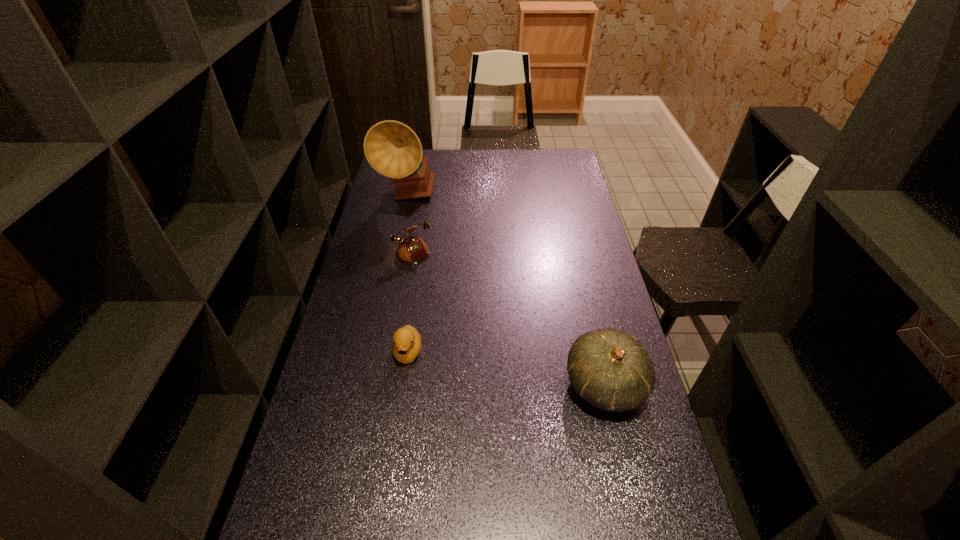
Image resolution: width=960 pixels, height=540 pixels. In order to click on free space at the right edge of the desktop in this screenshot , I will do `click(578, 261)`.

Locate an element on the screen. The width and height of the screenshot is (960, 540). vacant area at the far right corner is located at coordinates click(557, 157).

This screenshot has height=540, width=960. What are the coordinates of `vacant region between the tallest object and the telephone` in the screenshot? It's located at (402, 230).

Where is `vacant space that's between the second farthest object and the duckling`? This screenshot has width=960, height=540. vacant space that's between the second farthest object and the duckling is located at coordinates (403, 308).

The width and height of the screenshot is (960, 540). In order to click on unoccupied area between the farthest object and the telephone in this screenshot , I will do `click(402, 230)`.

At what (x,y) coordinates should I click in order to perform the action: click on unoccupied position between the second farthest object and the farthest object. Please return your answer as a coordinate pair (x, y). Looking at the image, I should click on (402, 230).

This screenshot has width=960, height=540. Identify the location of vacant space that is in between the telephone and the duckling. (403, 308).

Locate an element on the screen. The image size is (960, 540). free space between the duckling and the third nearest object is located at coordinates click(x=403, y=308).

At what (x,y) coordinates should I click in order to perform the action: click on free area in between the farthest object and the rightmost object. Please return your answer as a coordinate pair (x, y). The height and width of the screenshot is (540, 960). Looking at the image, I should click on (506, 290).

Identify the location of empty space that is in between the telephone and the gourd. This screenshot has width=960, height=540. (501, 325).